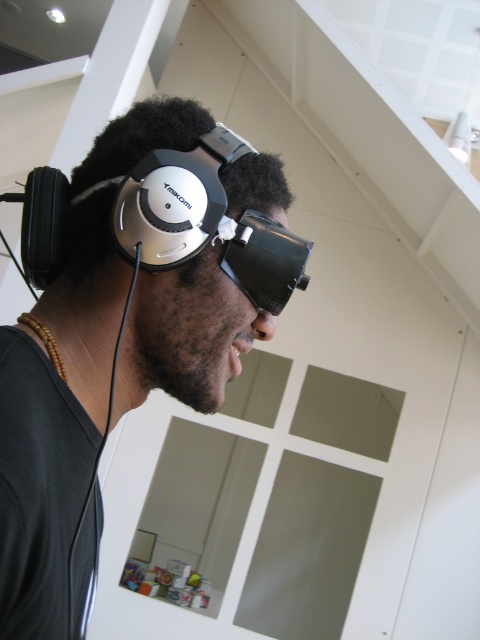
Which is in front, point (173, 328) or point (289, 232)?

Point (173, 328)

Between point (51, 465) and point (297, 253), which one is positioned behind?

Positioned behind is point (297, 253).

At what (x,y) coordinates should I click in order to perform the action: click on matte black headphones at left. Please return your answer as a coordinate pair (x, y). The width and height of the screenshot is (480, 640). Looking at the image, I should click on (128, 326).